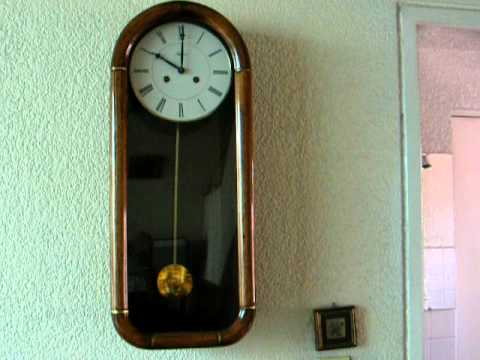
Image resolution: width=480 pixels, height=360 pixels. In order to click on wall in this screenshot , I will do `click(325, 40)`.